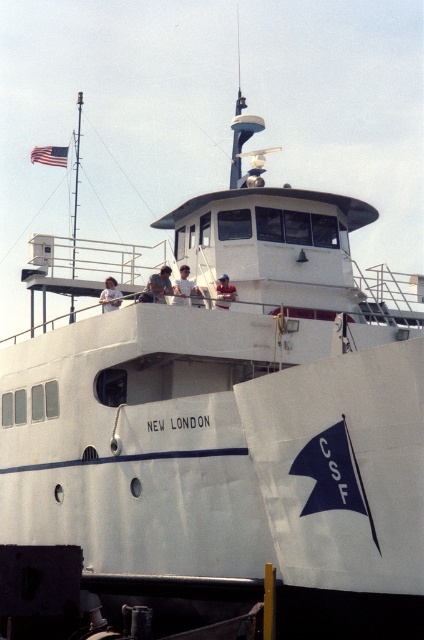
Question: From the image, what is the correct spatial relationship of light brown hair at upper center in relation to light brown wooden stick at center?

Choices:
 (A) below
 (B) above

Answer: (A)

Question: Can you confirm if matte skin person at center is positioned to the right of light brown wooden stick at center?

Choices:
 (A) yes
 (B) no

Answer: (B)

Question: Which of these objects is positioned farthest from the light brown hair at upper center?

Choices:
 (A) white matte shirt at center
 (B) matte skin person at center
 (C) light brown wooden stick at center

Answer: (C)

Question: Among these points, which one is farthest from the camera?

Choices:
 (A) (175, 289)
 (B) (106, 289)
 (C) (159, 296)

Answer: (B)

Question: Which point appears closest to the camera in this image?

Choices:
 (A) (226, 305)
 (B) (109, 305)
 (C) (184, 304)
 (D) (156, 282)

Answer: (C)

Question: Does matte skin person at center appear on the left side of light brown wooden stick at center?

Choices:
 (A) no
 (B) yes

Answer: (B)